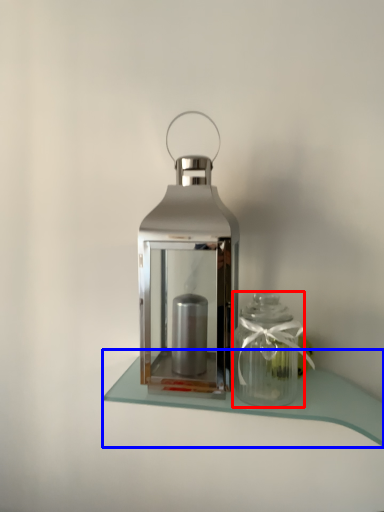
Question: Which object is further to the camera taking this photo, glass vase (highlighted by a red box) or table (highlighted by a blue box)?

Choices:
 (A) glass vase
 (B) table

Answer: (A)